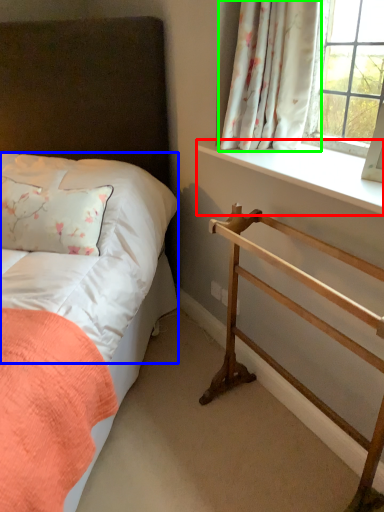
Question: Which is nearer to the window sill (highlighted by a red box)? sheet (highlighted by a blue box) or curtain (highlighted by a green box).

Choices:
 (A) sheet
 (B) curtain

Answer: (B)